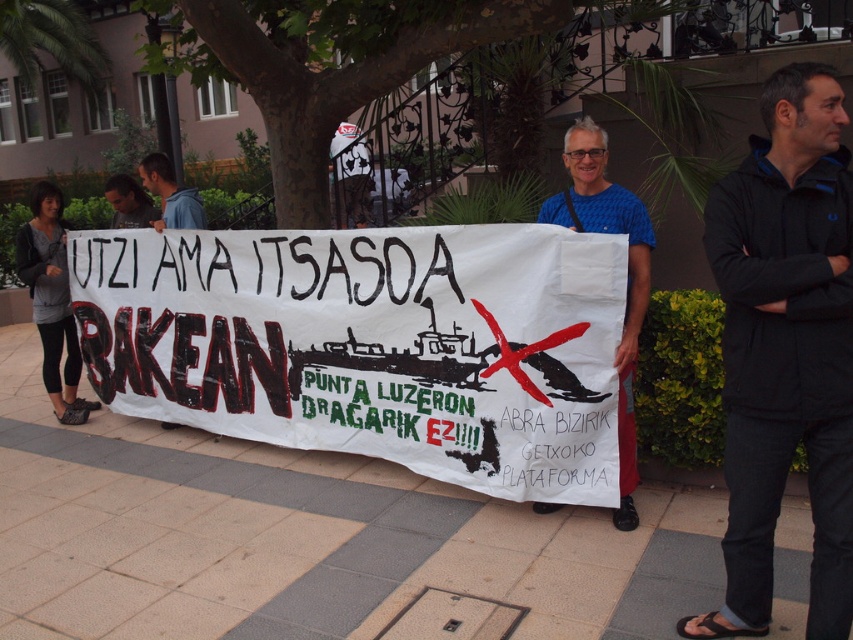
Question: Which of the following is the closest to the observer?

Choices:
 (A) black fleece jacket at center
 (B) blue fabric at center
 (C) white paper banner at center
 (D) dark blue hoodie at upper left

Answer: (A)

Question: Is white paper banner at center wider than black fleece jacket at center?

Choices:
 (A) yes
 (B) no

Answer: (A)

Question: Which point is farther to the camera?

Choices:
 (A) (634, 451)
 (B) (283, 260)
 (C) (134, 193)

Answer: (C)

Question: Is white paper banner at center bigger than blue fabric at center?

Choices:
 (A) no
 (B) yes

Answer: (B)

Question: Does black fleece jacket at center lie in front of dark blue hoodie at upper left?

Choices:
 (A) no
 (B) yes

Answer: (B)

Question: Which object is positioned closest to the blue hoodie at center?

Choices:
 (A) dark blue hoodie at upper left
 (B) black fleece jacket at center
 (C) blue fabric at center

Answer: (A)